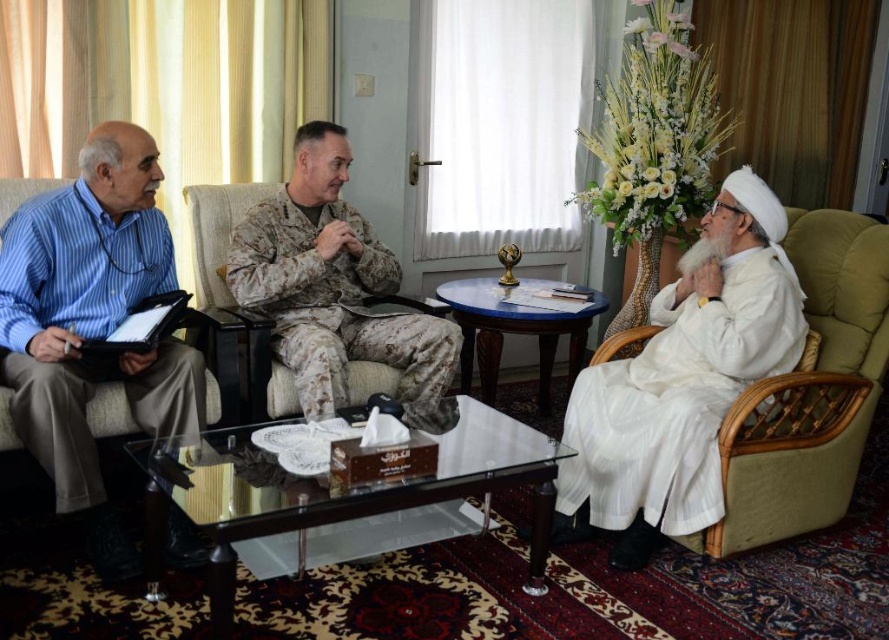
Question: Among these objects, which one is farthest from the camera?

Choices:
 (A) blue striped shirt at left
 (B) matte black laptop at left
 (C) white silk robe at right

Answer: (C)

Question: Considering the relative positions of blue striped shirt at left and white silk robe at right in the image provided, where is blue striped shirt at left located with respect to white silk robe at right?

Choices:
 (A) below
 (B) above

Answer: (B)

Question: Does matte black laptop at left appear under blue striped shirt at left?

Choices:
 (A) yes
 (B) no

Answer: (B)

Question: Estimate the real-world distances between objects in this image. Which object is closer to the matte black laptop at left?

Choices:
 (A) white silk robe at right
 (B) camouflage uniform at center
 (C) blue striped shirt at left

Answer: (C)

Question: Does blue striped shirt at left appear on the right side of camouflage uniform at center?

Choices:
 (A) yes
 (B) no

Answer: (B)

Question: Which is nearer to the camouflage uniform at center?

Choices:
 (A) white silk robe at right
 (B) blue striped shirt at left

Answer: (B)